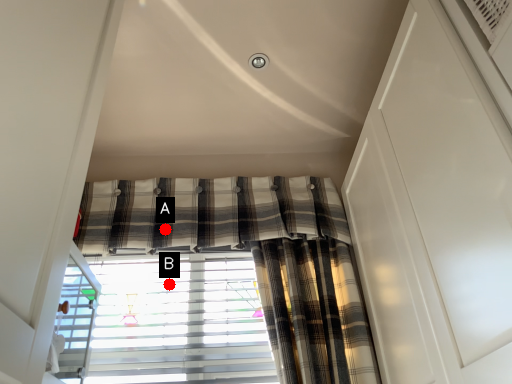
Question: Two points are circled on the image, labeled by A and B beside each circle. Which point is closer to the camera?

Choices:
 (A) A is closer
 (B) B is closer

Answer: (A)